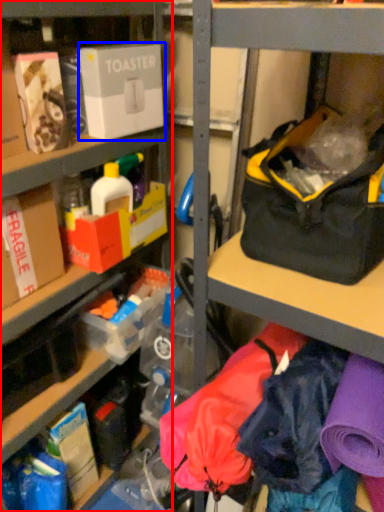
Question: Among these objects, which one is nearest to the camera, shelf (highlighted by a red box) or box (highlighted by a blue box)?

Choices:
 (A) shelf
 (B) box

Answer: (A)